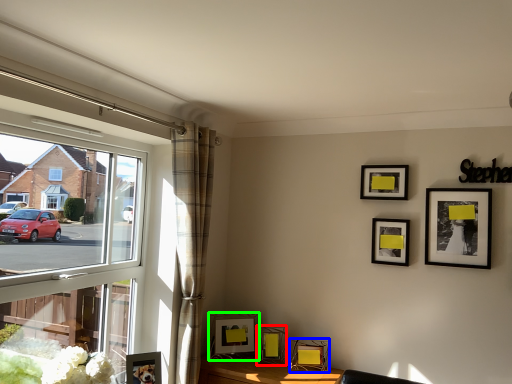
Question: Estimate the real-world distances between objects in this image. Which object is closer to picture frame (highlighted by a red box), picture frame (highlighted by a blue box) or picture frame (highlighted by a green box)?

Choices:
 (A) picture frame
 (B) picture frame

Answer: (B)